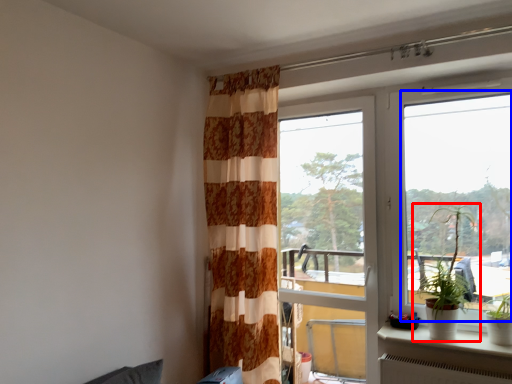
Question: Which of the following is the farthest to the observer, houseplant (highlighted by a red box) or window (highlighted by a blue box)?

Choices:
 (A) houseplant
 (B) window

Answer: (A)